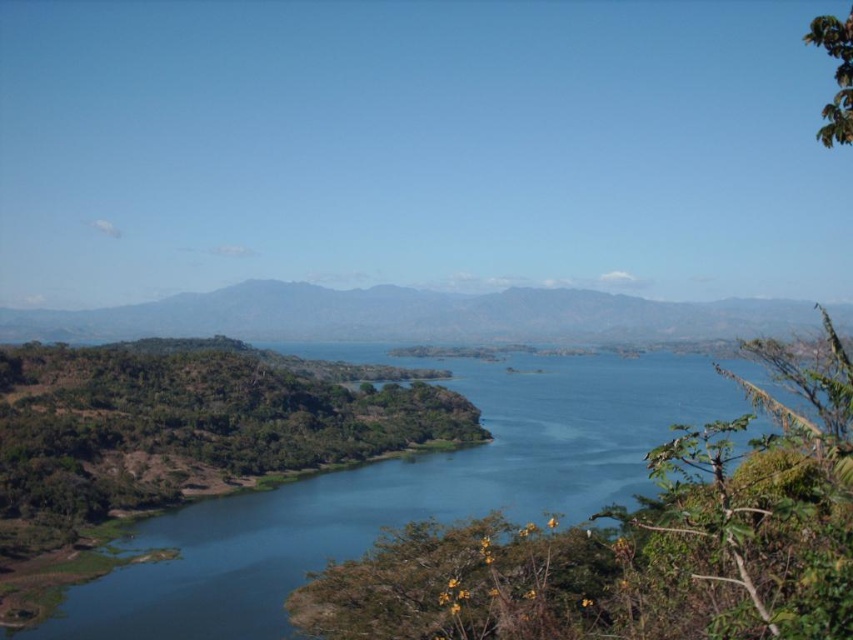
You are standing on the shore looking out at the blue water at center and the green matte mountain at center. Which object is closer to you?

The blue water at center is closer to you because it is positioned below the green matte mountain at center, indicating it is in a lower elevation.

You are standing at the point closer to the mountains in the background. Which point are you standing at, point (358, 508) or point (425, 291)?

You are standing at point (425, 291) because it is behind point (358, 508), so it is closer to the mountains in the background.

You are an artist planning to paint the landscape. You want to ensure the blue water at center and the green matte mountain at center are proportionally accurate. Based on the scene, which object should you make narrower in your painting?

The blue water at center should be made narrower since its width is less than the green matte mountain at center according to the description.